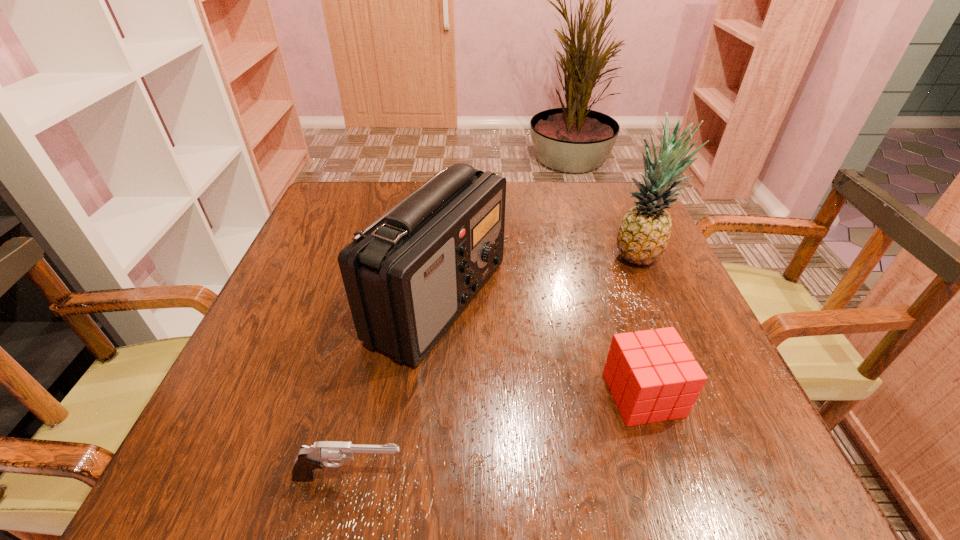
You are a GUI agent. You are given a task and a screenshot of the screen. Output one action in this format:
    pyautogui.click(x=<x>, y=<y>)
    Task: Click on the tallest object
    Image resolution: width=960 pixels, height=540 pixels.
    Given the screenshot: What is the action you would take?
    pyautogui.click(x=643, y=235)

The width and height of the screenshot is (960, 540). I want to click on the third shortest object, so click(408, 276).

Locate an element on the screen. This screenshot has height=540, width=960. cube is located at coordinates (653, 376).

Where is `gun`? This screenshot has width=960, height=540. gun is located at coordinates (310, 458).

The image size is (960, 540). I want to click on free spot located 0.310m on the left of the tallest object, so click(472, 256).

Locate an element on the screen. The width and height of the screenshot is (960, 540). vacant region located 0.320m on the front panel of the second tallest object is located at coordinates [x=665, y=300].

Identify the location of blank area located on the back of the cube. (609, 288).

Find the location of a particular element. The image size is (960, 540). vacant space located at the muzzle of the nearest object is located at coordinates (685, 477).

I want to click on object present at the near edge, so click(310, 458).

Identify the location of object situated at the left edge. (310, 458).